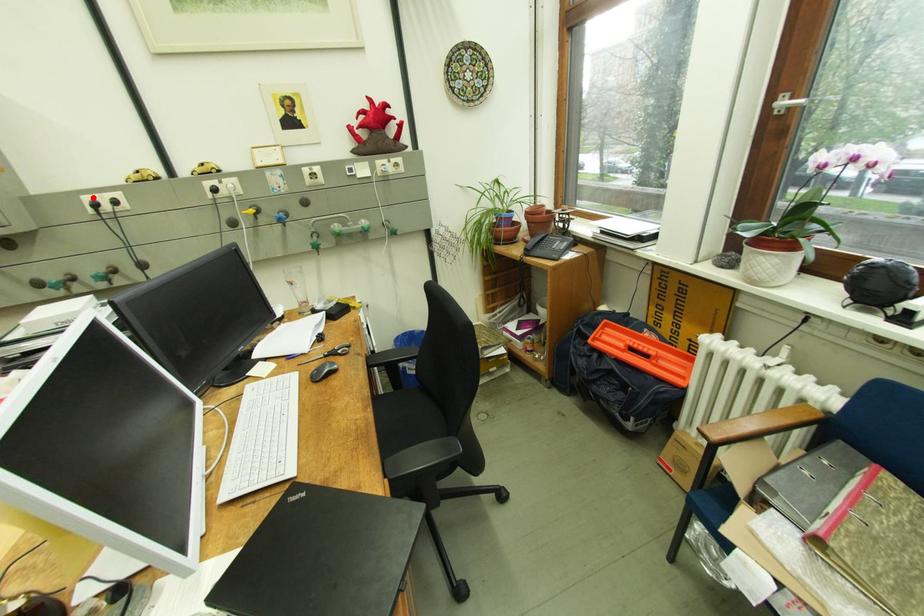
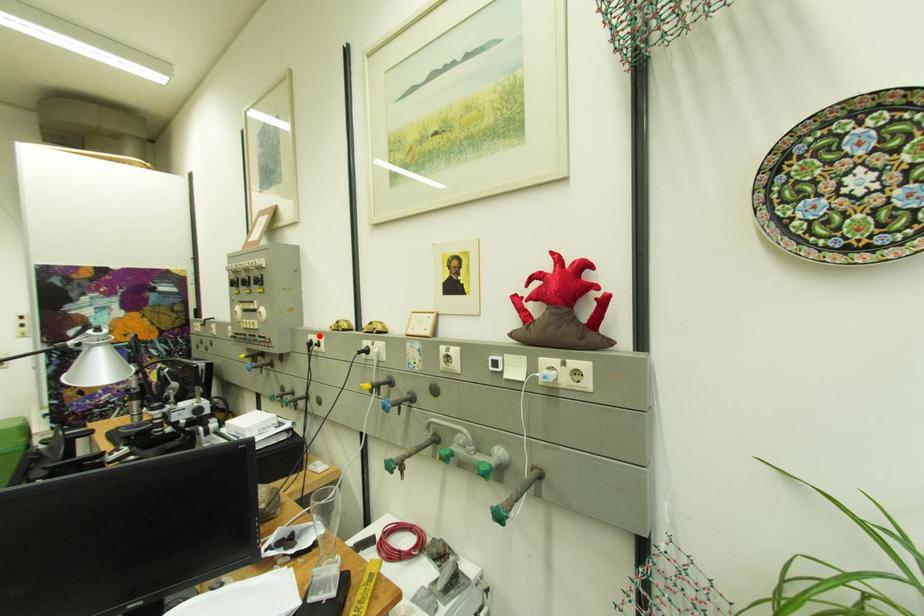
I am providing you with two images of the same scene from different viewpoints. A red point is marked on the first image and another point is marked on the second image. Do the highlighted points in image1 and image2 indicate the same real-world spot?

Yes